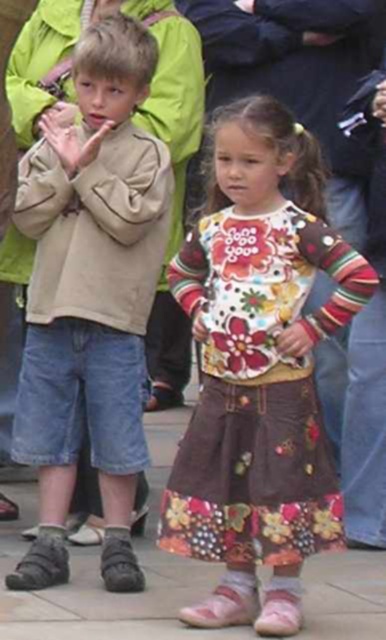
I want to click on floral cotton dress at center, so click(257, 388).

Is floral cotton dress at center to the right of smooth concrete pavement at center from the viewer's perspective?

No, floral cotton dress at center is not to the right of smooth concrete pavement at center.

Identify the location of floral cotton dress at center. (257, 388).

The height and width of the screenshot is (640, 386). Find the location of `light brown suede jacket at center`. light brown suede jacket at center is located at coordinates (91, 298).

Can you confirm if light brown suede jacket at center is shorter than floral cotton dress at center?

Indeed, light brown suede jacket at center has a lesser height compared to floral cotton dress at center.

Which is in front, point (116, 246) or point (245, 260)?

Point (245, 260) is more forward.

Locate an element on the screen. light brown suede jacket at center is located at coordinates pyautogui.click(x=91, y=298).

Between light brown suede jacket at center and smooth concrete pavement at center, which one has less height?

With less height is smooth concrete pavement at center.

Describe the element at coordinates (91, 298) in the screenshot. I see `light brown suede jacket at center` at that location.

Where is `light brown suede jacket at center`? The image size is (386, 640). light brown suede jacket at center is located at coordinates (91, 298).

Identify the location of light brown suede jacket at center. This screenshot has height=640, width=386. (91, 298).